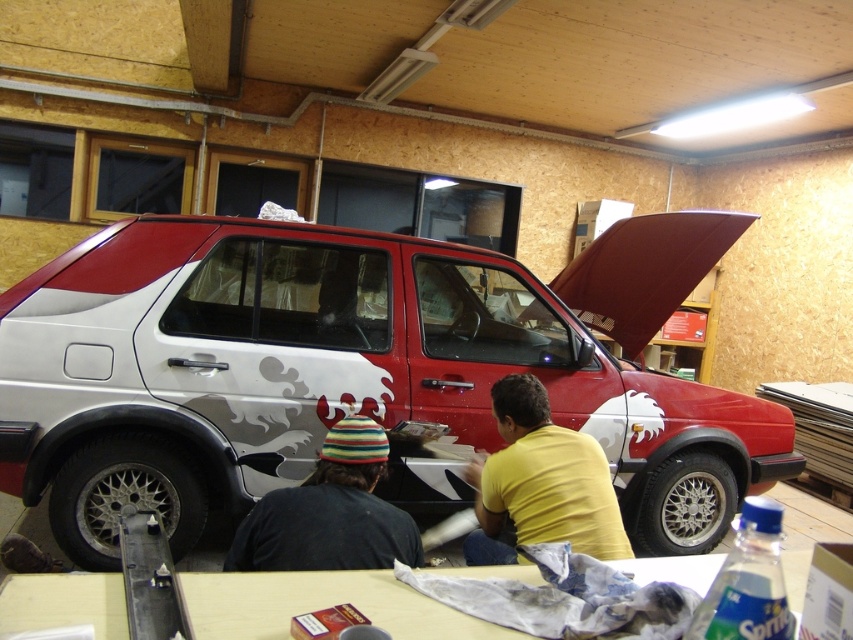
Question: Which point is closer to the camera taking this photo?

Choices:
 (A) (325, 544)
 (B) (428, 362)
 (C) (622, 564)

Answer: (C)

Question: Estimate the real-world distances between objects in this image. Which object is closer to the yellow matte shirt at center?

Choices:
 (A) metallic silver car at center
 (B) striped knit hat at lower center
 (C) wooden table at lower center

Answer: (B)

Question: Which point is farther from the camera taking this photo?

Choices:
 (A) (550, 440)
 (B) (149, 436)
 (C) (379, 586)
 (D) (254, 554)

Answer: (B)

Question: Is metallic silver car at center smaller than striped knit hat at lower center?

Choices:
 (A) no
 (B) yes

Answer: (A)

Question: From the image, what is the correct spatial relationship of wooden table at lower center in relation to yellow matte shirt at center?

Choices:
 (A) left
 (B) right

Answer: (A)

Question: From the image, what is the correct spatial relationship of yellow matte shirt at center in relation to striped knit hat at lower center?

Choices:
 (A) above
 (B) below

Answer: (B)